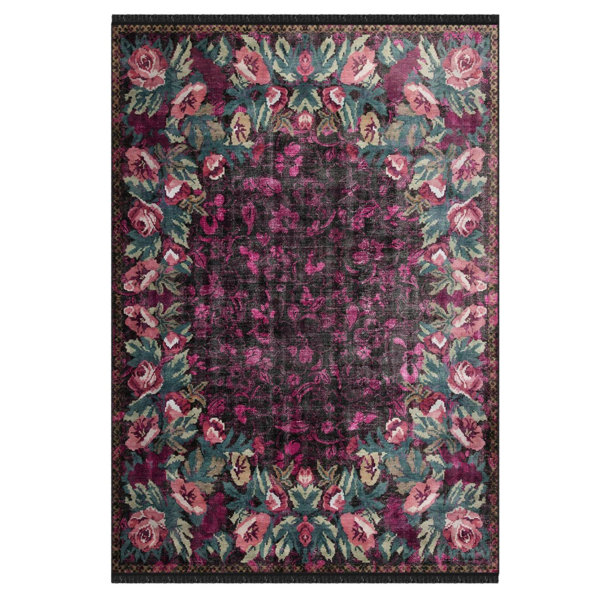
What are the coordinates of `center of the rug` in the screenshot? It's located at 301,290.